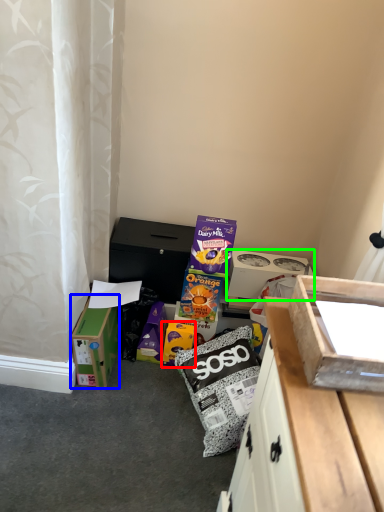
Question: Considering the real-world distances, which object is farthest from cardboard box (highlighted by a red box)? box (highlighted by a blue box) or box (highlighted by a green box)?

Choices:
 (A) box
 (B) box

Answer: (B)